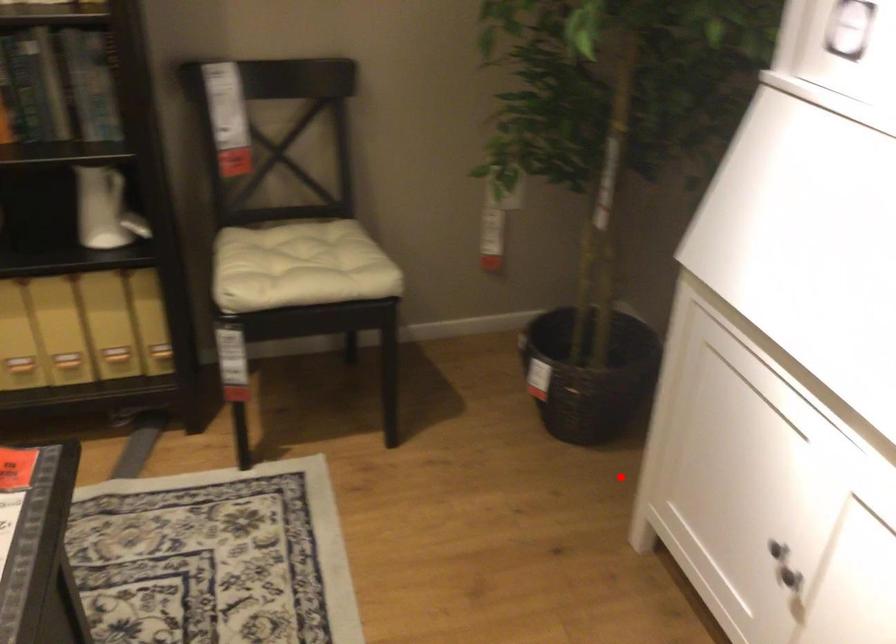
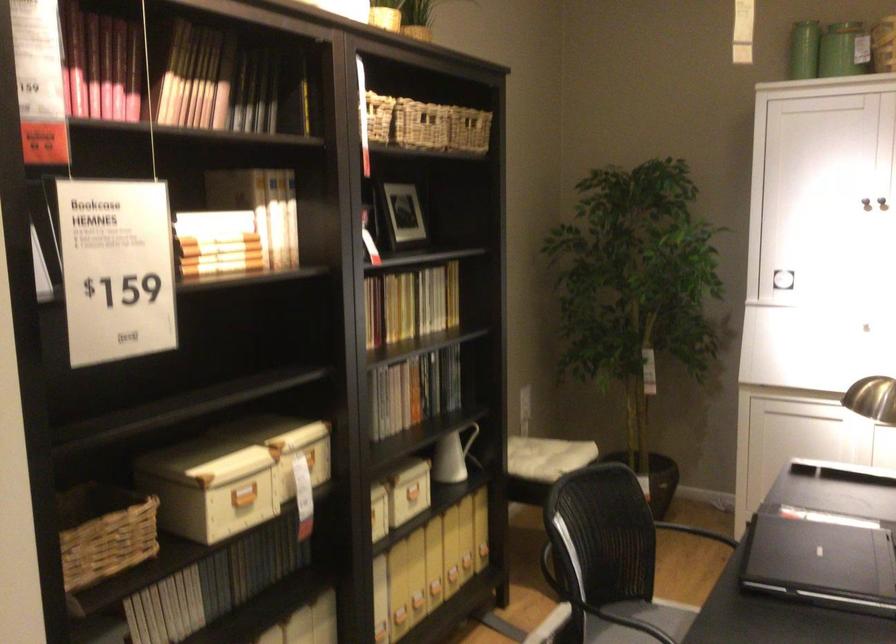
Where in the second image is the point corresponding to the highlighted location from the first image?

(695, 532)